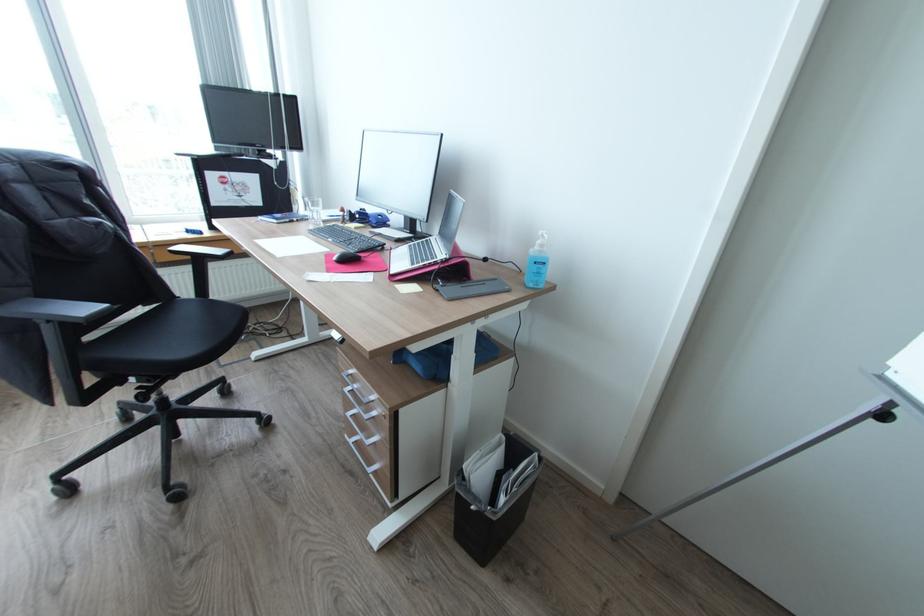
Find where to resting arm the black chair armrest. Please return your answer as a coordinate pair (x, y).

(63, 310)